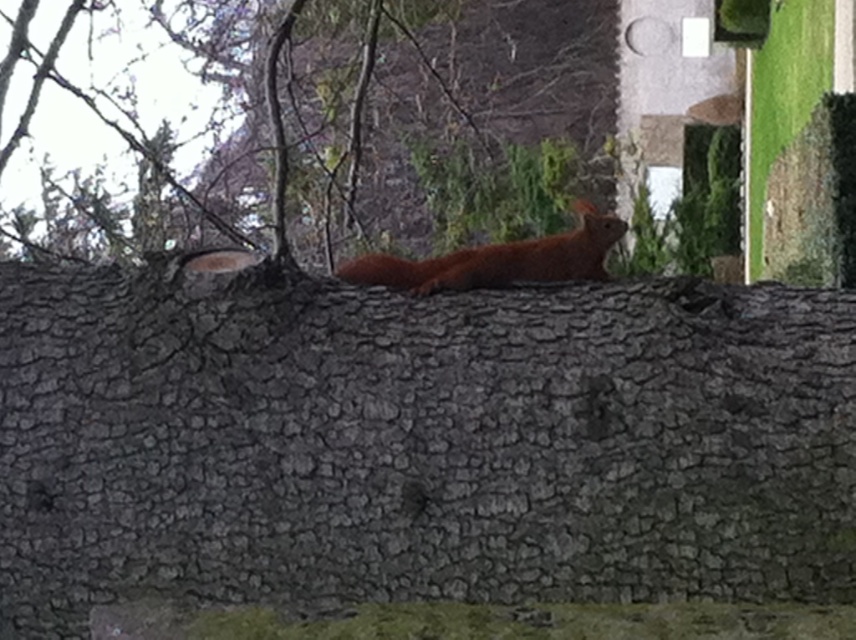
Consider the image. Does cracked bark tree trunk at center appear over shiny reddish-brown squirrel at center?

Actually, cracked bark tree trunk at center is below shiny reddish-brown squirrel at center.

Consider the image. Is cracked bark tree trunk at center taller than shiny reddish-brown squirrel at center?

Correct, cracked bark tree trunk at center is much taller as shiny reddish-brown squirrel at center.

This screenshot has height=640, width=856. Describe the element at coordinates (418, 442) in the screenshot. I see `cracked bark tree trunk at center` at that location.

Identify the location of cracked bark tree trunk at center. The height and width of the screenshot is (640, 856). (418, 442).